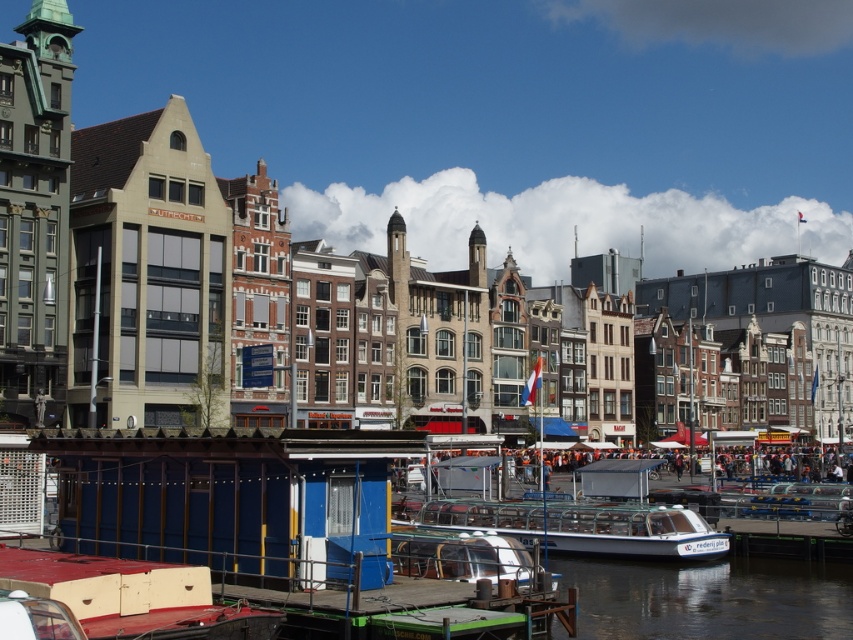
Who is lower down, white glossy boat at center or orange fabric crowd at center?

orange fabric crowd at center

Is white glossy boat at center bigger than orange fabric crowd at center?

Incorrect, white glossy boat at center is not larger than orange fabric crowd at center.

Locate an element on the screen. white glossy boat at center is located at coordinates (585, 525).

Identify the location of white glossy boat at center. This screenshot has height=640, width=853. (585, 525).